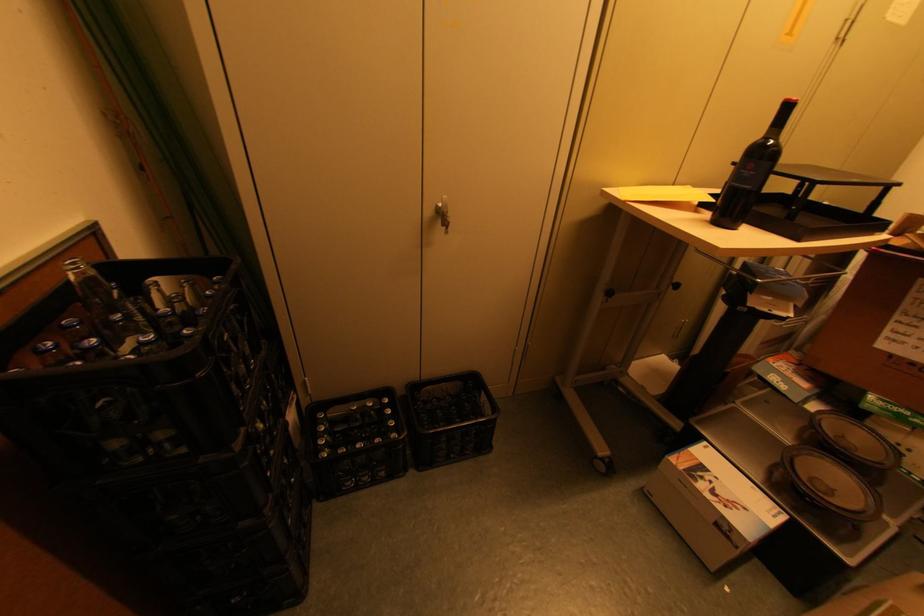
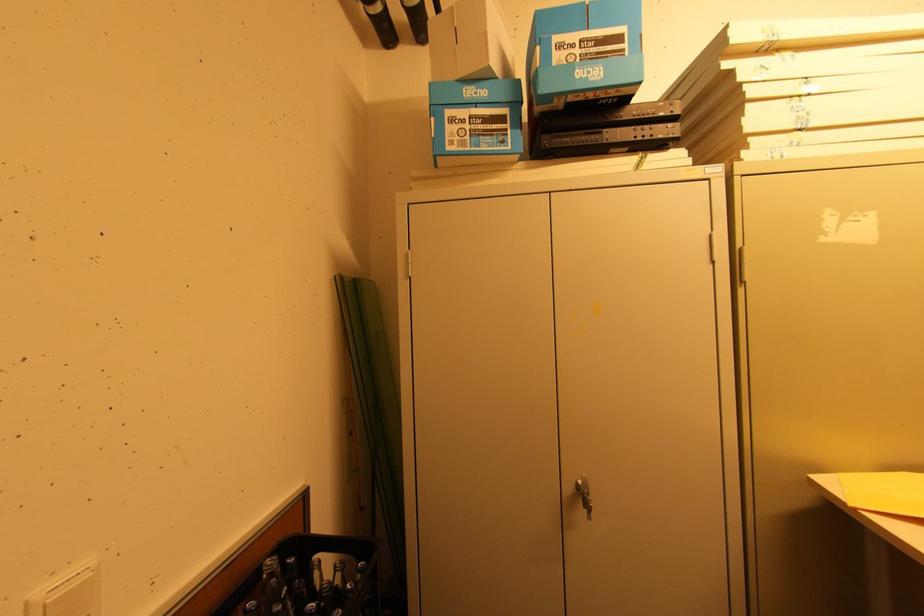
In the second image, find the point that corresponds to [144,298] in the first image.

(306, 582)